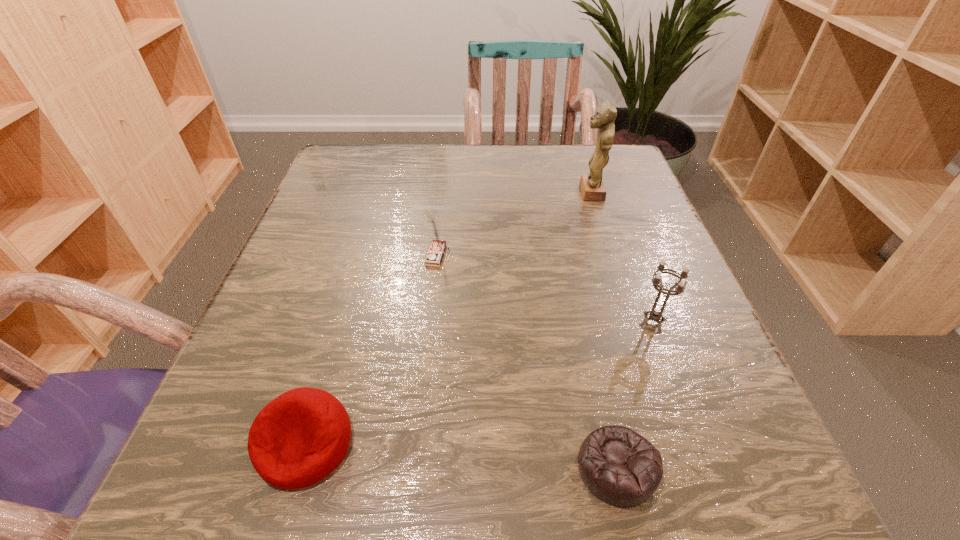
Identify the location of vacant space located on the front-facing side of the figurine. (531, 192).

Locate an element on the screen. vacant region located 0.110m on the front-facing side of the figurine is located at coordinates (527, 192).

The width and height of the screenshot is (960, 540). I want to click on vacant space located 0.170m on the left of the fourth object from right to left, so click(x=334, y=255).

Where is `blank space located on the front of the candle holder`? blank space located on the front of the candle holder is located at coordinates (684, 407).

The height and width of the screenshot is (540, 960). Identify the location of free region located on the left of the shortest object. (354, 468).

This screenshot has height=540, width=960. Find the location of `object at the far edge`. object at the far edge is located at coordinates (592, 187).

Where is `object located in the left edge section of the desktop`? This screenshot has width=960, height=540. object located in the left edge section of the desktop is located at coordinates (299, 438).

This screenshot has height=540, width=960. Identify the location of figurine at the right edge. (592, 187).

At what (x,y) coordinates should I click in order to perform the action: click on candle holder at the right edge. Please return your answer as a coordinate pair (x, y). Image resolution: width=960 pixels, height=540 pixels. Looking at the image, I should click on (654, 315).

Find the location of `beanbag that is at the right edge`. beanbag that is at the right edge is located at coordinates (619, 466).